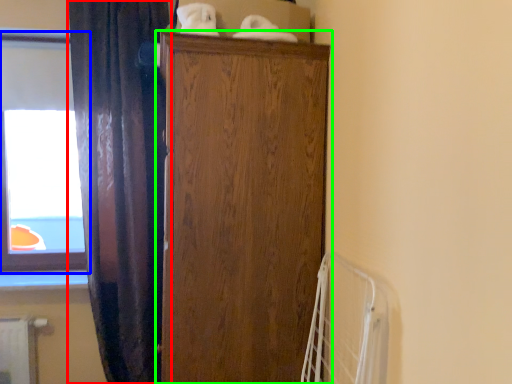
Question: Which object is the closest to the curtain (highlighted by a red box)? Choose among these: window (highlighted by a blue box) or cupboard (highlighted by a green box).

Choices:
 (A) window
 (B) cupboard

Answer: (A)